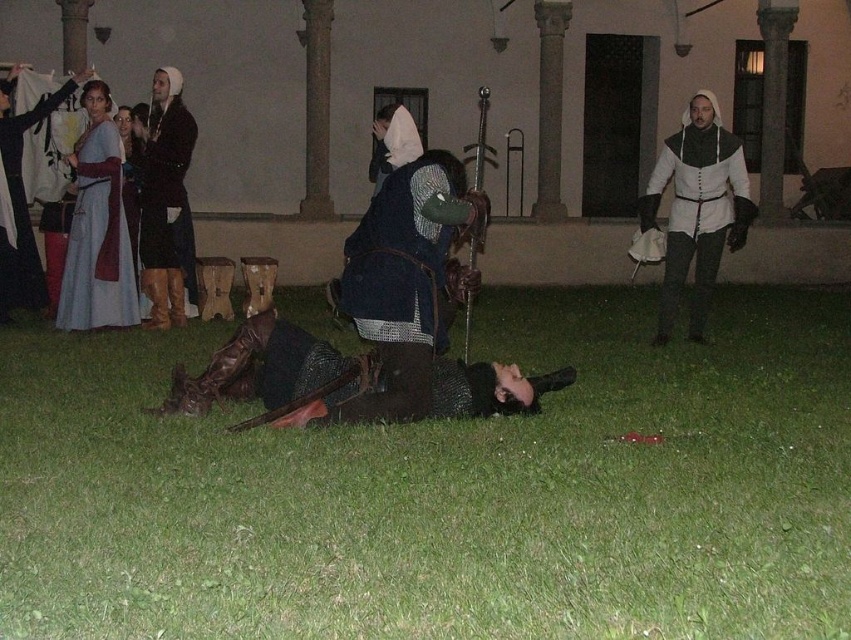
Question: Is metallic chainmail helmet at center to the left of matte black tunic at upper left from the viewer's perspective?

Choices:
 (A) yes
 (B) no

Answer: (B)

Question: Among these objects, which one is farthest from the camera?

Choices:
 (A) matte black tunic at upper left
 (B) white matte armor at center

Answer: (A)

Question: Estimate the real-world distances between objects in this image. Which object is closer to the matte black dress at upper left?

Choices:
 (A) dark blue leather vest at center
 (B) matte blue dress at upper left

Answer: (B)

Question: Among these points, which one is farthest from the camera?

Choices:
 (A) (700, 266)
 (B) (72, 166)
 (C) (415, 294)
 (D) (318, 348)

Answer: (B)

Question: Considering the relative positions of green grass at lower center and matte blue dress at upper left in the image provided, where is green grass at lower center located with respect to matte blue dress at upper left?

Choices:
 (A) left
 (B) right

Answer: (B)

Question: In this image, where is dark blue leather vest at center located relative to white matte armor at center?

Choices:
 (A) left
 (B) right

Answer: (A)